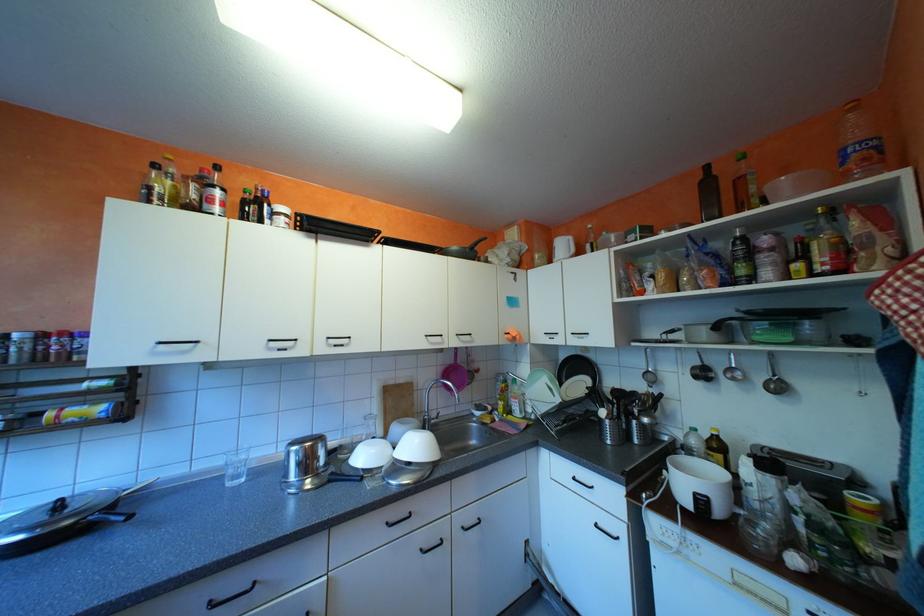
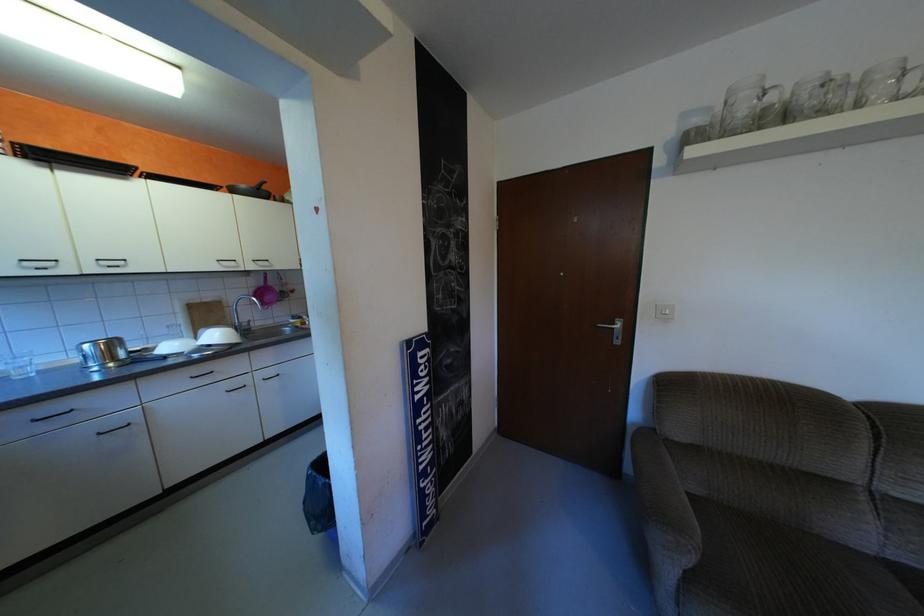
The images are taken continuously from a first-person perspective. In which direction are you moving?

The cameraman walked toward right, backward.